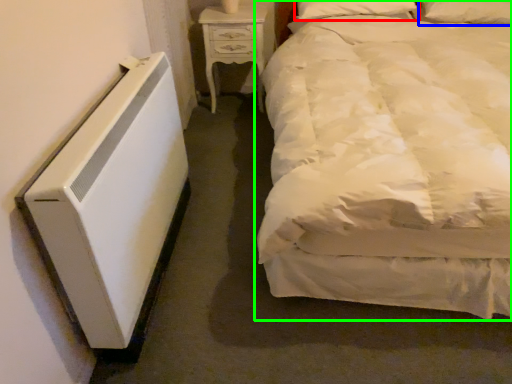
Question: Which is farther away from pillow (highlighted by a red box)? pillow (highlighted by a blue box) or bed (highlighted by a green box)?

Choices:
 (A) pillow
 (B) bed

Answer: (B)